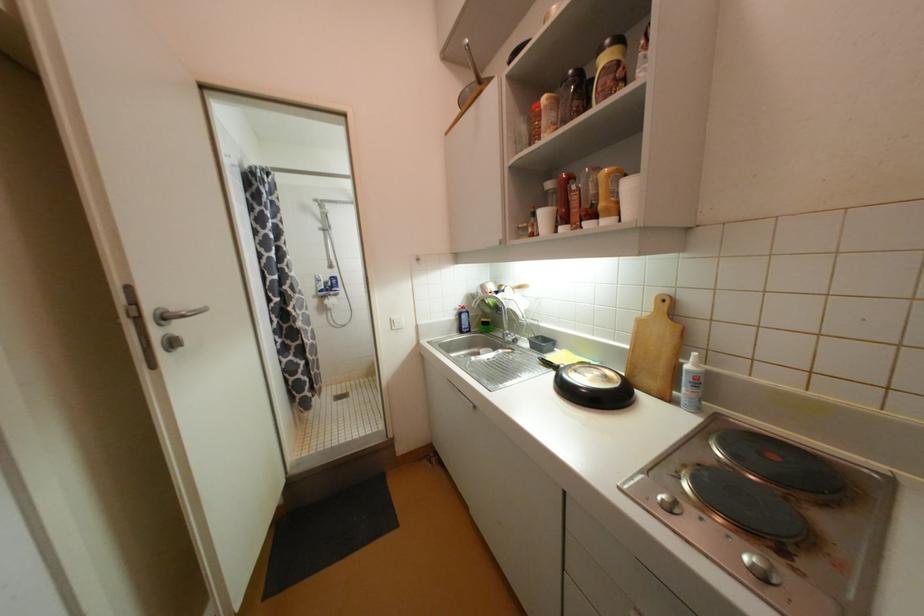
This screenshot has height=616, width=924. In order to click on white light switch in this screenshot , I will do point(395,323).